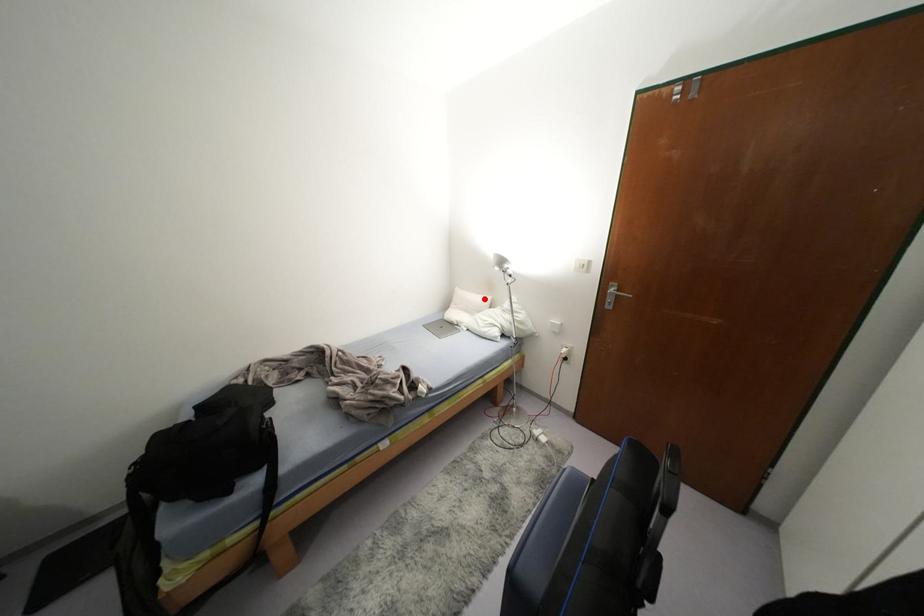
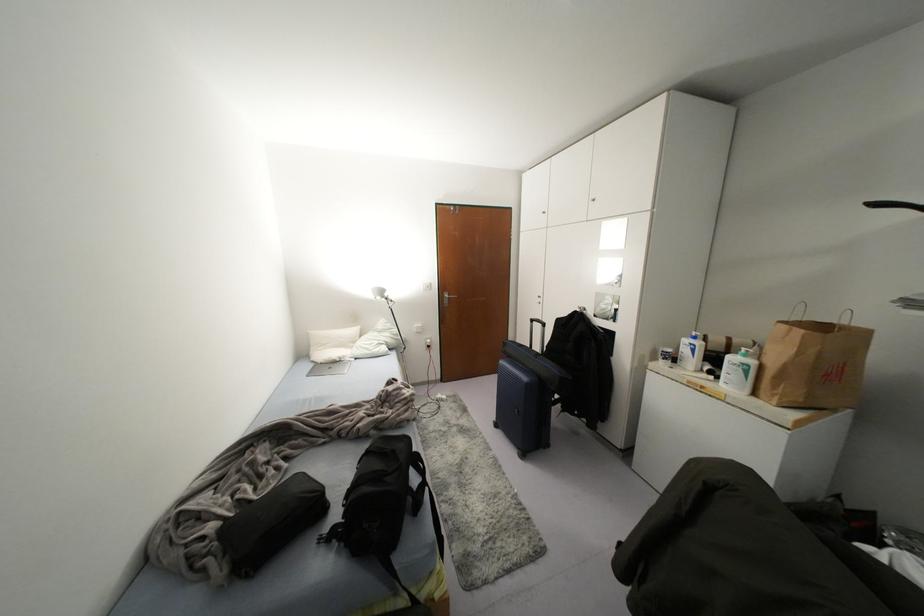
Locate, in the second image, the point that corresponds to the highlighted location in the first image.

(354, 330)